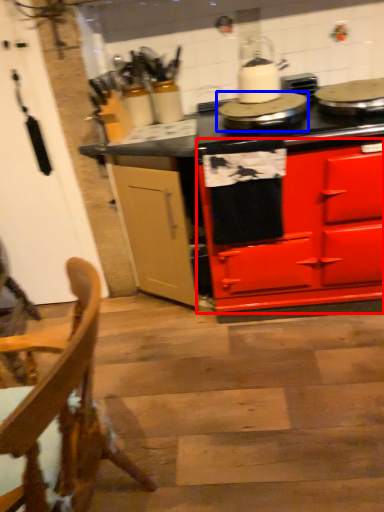
Question: Among these objects, which one is nearest to the camera, cabinetry (highlighted by a red box) or appliance (highlighted by a blue box)?

Choices:
 (A) cabinetry
 (B) appliance

Answer: (A)